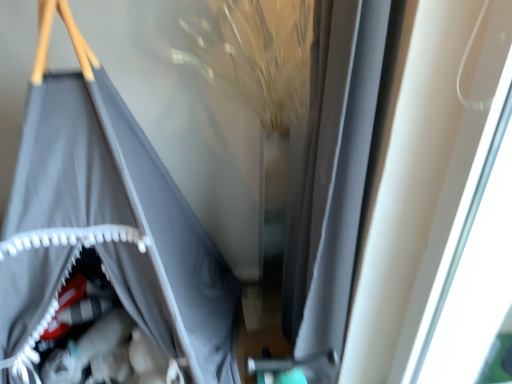
Question: From a real-world perspective, is white plastic window at upper right above or below matte gray fabric at left?

Choices:
 (A) below
 (B) above

Answer: (B)

Question: Considering the positions of white plastic window at upper right and matte gray fabric at left in the image, is white plastic window at upper right wider or thinner than matte gray fabric at left?

Choices:
 (A) thin
 (B) wide

Answer: (A)

Question: Based on their positions, is white plastic window at upper right located to the left or right of matte gray fabric at left?

Choices:
 (A) left
 (B) right

Answer: (B)

Question: From a real-world perspective, relative to white plastic window at upper right, is matte gray fabric at left vertically above or below?

Choices:
 (A) below
 (B) above

Answer: (A)

Question: Is matte gray fabric at left to the left or to the right of white plastic window at upper right in the image?

Choices:
 (A) right
 (B) left

Answer: (B)

Question: In terms of height, does matte gray fabric at left look taller or shorter compared to white plastic window at upper right?

Choices:
 (A) tall
 (B) short

Answer: (A)

Question: In terms of width, does matte gray fabric at left look wider or thinner when compared to white plastic window at upper right?

Choices:
 (A) thin
 (B) wide

Answer: (B)